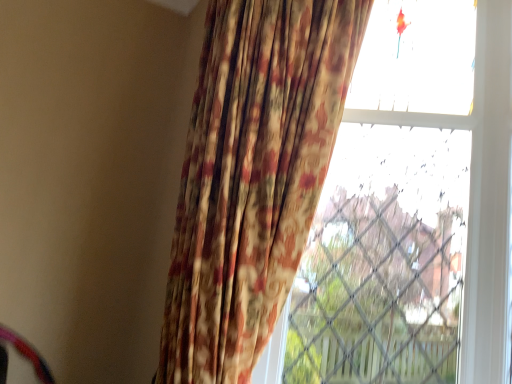
Question: Is floral fabric curtain at center turned away from transparent glass window at upper right?

Choices:
 (A) yes
 (B) no

Answer: (A)

Question: Considering the relative sizes of floral fabric curtain at center and transparent glass window at upper right in the image provided, is floral fabric curtain at center shorter than transparent glass window at upper right?

Choices:
 (A) yes
 (B) no

Answer: (A)

Question: Considering the relative positions of floral fabric curtain at center and transparent glass window at upper right in the image provided, is floral fabric curtain at center to the left of transparent glass window at upper right from the viewer's perspective?

Choices:
 (A) no
 (B) yes

Answer: (B)

Question: Is floral fabric curtain at center aimed at transparent glass window at upper right?

Choices:
 (A) no
 (B) yes

Answer: (A)

Question: Does floral fabric curtain at center have a larger size compared to transparent glass window at upper right?

Choices:
 (A) yes
 (B) no

Answer: (A)

Question: Is floral fabric curtain at center further to the viewer compared to transparent glass window at upper right?

Choices:
 (A) no
 (B) yes

Answer: (A)

Question: Considering the relative positions of transparent glass window at upper right and floral fabric curtain at center in the image provided, is transparent glass window at upper right in front of floral fabric curtain at center?

Choices:
 (A) no
 (B) yes

Answer: (A)

Question: From the image's perspective, is transparent glass window at upper right located beneath floral fabric curtain at center?

Choices:
 (A) yes
 (B) no

Answer: (A)

Question: Is transparent glass window at upper right shorter than floral fabric curtain at center?

Choices:
 (A) yes
 (B) no

Answer: (B)

Question: Is the position of transparent glass window at upper right more distant than that of floral fabric curtain at center?

Choices:
 (A) yes
 (B) no

Answer: (A)

Question: From a real-world perspective, is transparent glass window at upper right located higher than floral fabric curtain at center?

Choices:
 (A) no
 (B) yes

Answer: (B)

Question: Can you confirm if transparent glass window at upper right is smaller than floral fabric curtain at center?

Choices:
 (A) yes
 (B) no

Answer: (A)

Question: From a real-world perspective, is transparent glass window at upper right above or below floral fabric curtain at center?

Choices:
 (A) below
 (B) above

Answer: (B)